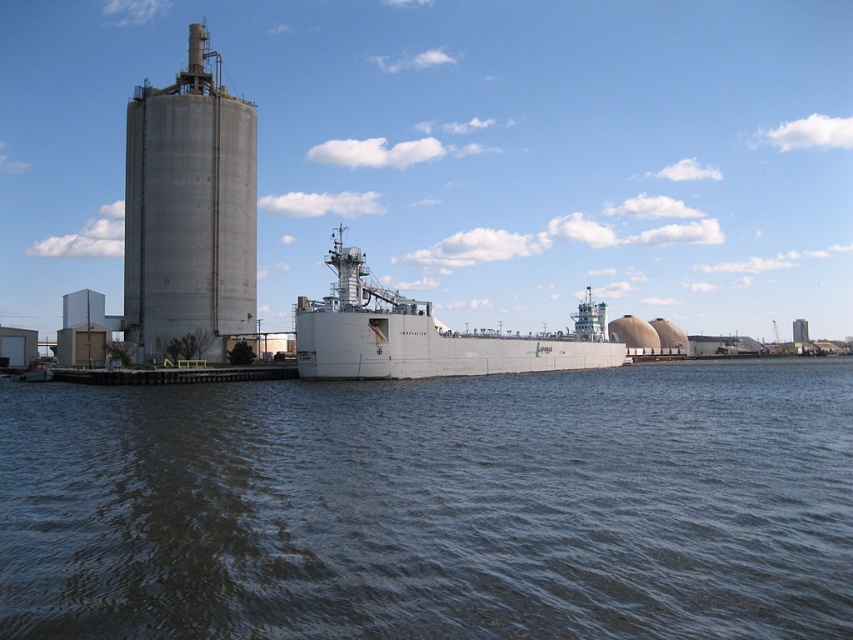
You are an engineer assessing the space between the concrete silo at left and the white matte ship at center. If the silo is narrower than the ship, will the ship be able to pass through a narrow channel that is exactly the width of the silo?

The concrete silo at left is narrower than the white matte ship at center. Since the channel is exactly the width of the silo, the ship would not fit through the channel as its width exceeds the silo.

You are navigating a small boat in the waterfront industrial scene. You notice two points marked on your map at coordinates point (142, 140) and point (305, 372). Which point is closer to your current position if you are positioned between them?

Point (305, 372) is closer to your current position because it is in front of point (142, 140) according to their spatial arrangement.